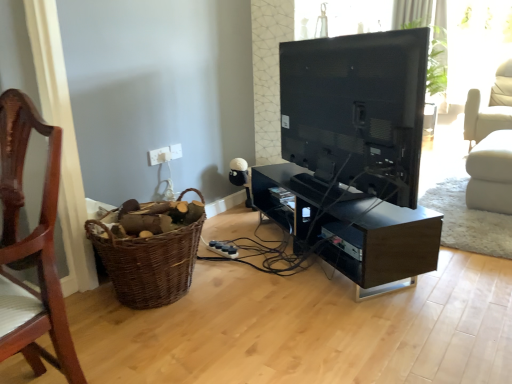
Locate an element on the screen. The image size is (512, 384). vacant area to the right of brown woven basket at lower left is located at coordinates (257, 287).